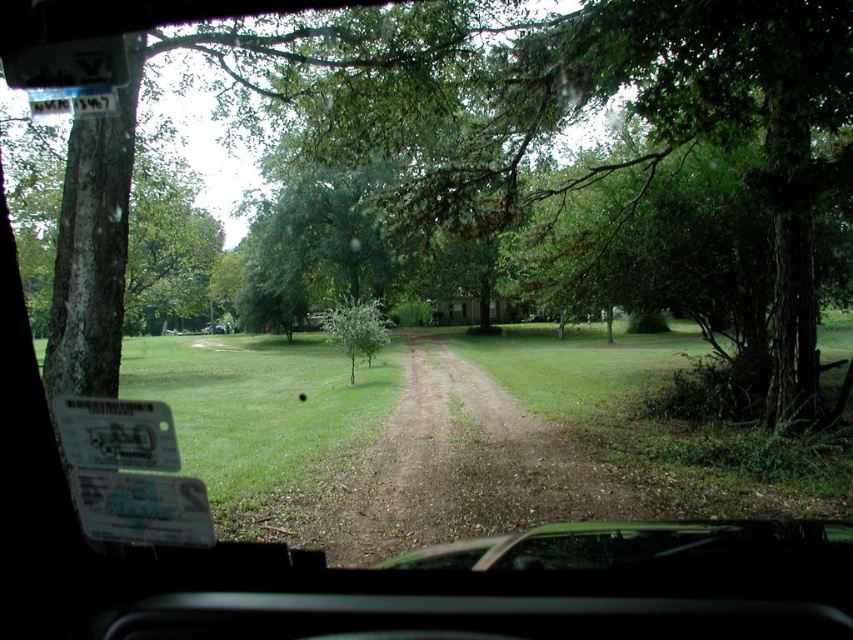
Question: Can you confirm if brown gravel dirt track at center is positioned below green leafy tree at center?

Choices:
 (A) no
 (B) yes

Answer: (B)

Question: Which of the following is the closest to the observer?

Choices:
 (A) (368, 483)
 (B) (347, 358)

Answer: (A)

Question: Can you confirm if brown gravel dirt track at center is positioned to the right of green leafy tree at center?

Choices:
 (A) yes
 (B) no

Answer: (A)

Question: In this image, where is brown gravel dirt track at center located relative to green leafy tree at center?

Choices:
 (A) below
 (B) above

Answer: (A)

Question: Which point is farther from the camera taking this photo?

Choices:
 (A) (344, 328)
 (B) (346, 477)

Answer: (A)